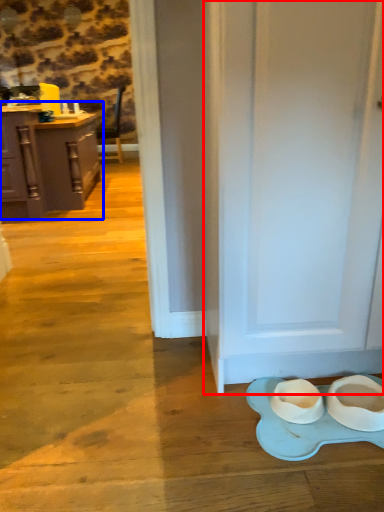
Question: Which point is further to the camera, door (highlighted by a red box) or cabinetry (highlighted by a blue box)?

Choices:
 (A) door
 (B) cabinetry

Answer: (B)